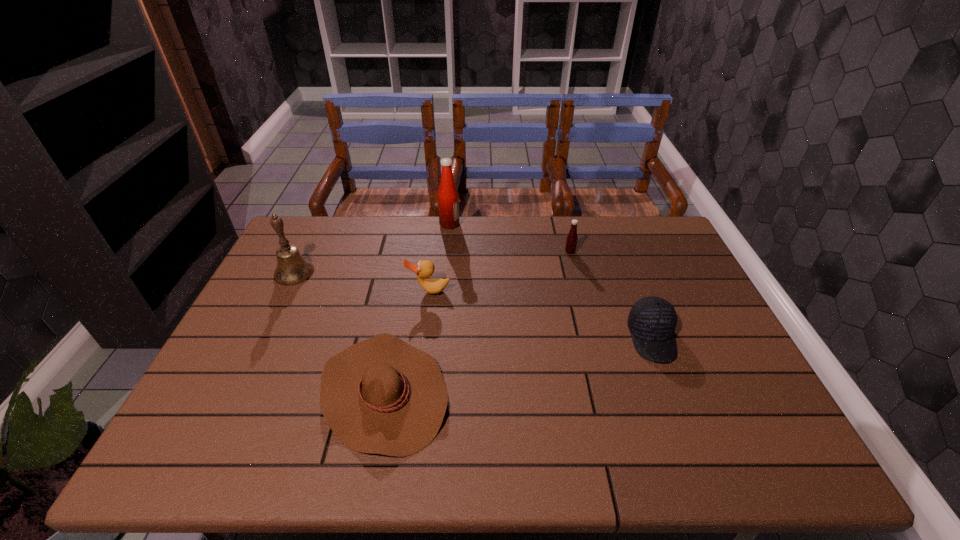
In order to click on the farthest object in this screenshot , I will do `click(448, 198)`.

Identify the location of the leftmost object. (292, 268).

Where is `the second object from right to left`? This screenshot has height=540, width=960. the second object from right to left is located at coordinates (571, 241).

Locate an element on the screen. The image size is (960, 540). Tabasco sauce is located at coordinates (571, 241).

This screenshot has height=540, width=960. What are the coordinates of `duck` in the screenshot? It's located at 424,269.

Locate an element on the screen. The height and width of the screenshot is (540, 960). the rightmost object is located at coordinates (652, 320).

Find the location of a particular element. cowboy hat is located at coordinates (383, 396).

Where is `vacant space positioned on the front-facing side of the farthest object`? vacant space positioned on the front-facing side of the farthest object is located at coordinates (493, 225).

You are a GUI agent. You are given a task and a screenshot of the screen. Output one action in this format:
    pyautogui.click(x=<x>, y=<y>)
    Task: Click on the free spot located on the right of the leftmost object
    
    Given the screenshot: What is the action you would take?
    pyautogui.click(x=428, y=273)

What are the coordinates of `vacant space located 0.330m on the front of the second farthest object` in the screenshot? It's located at (589, 329).